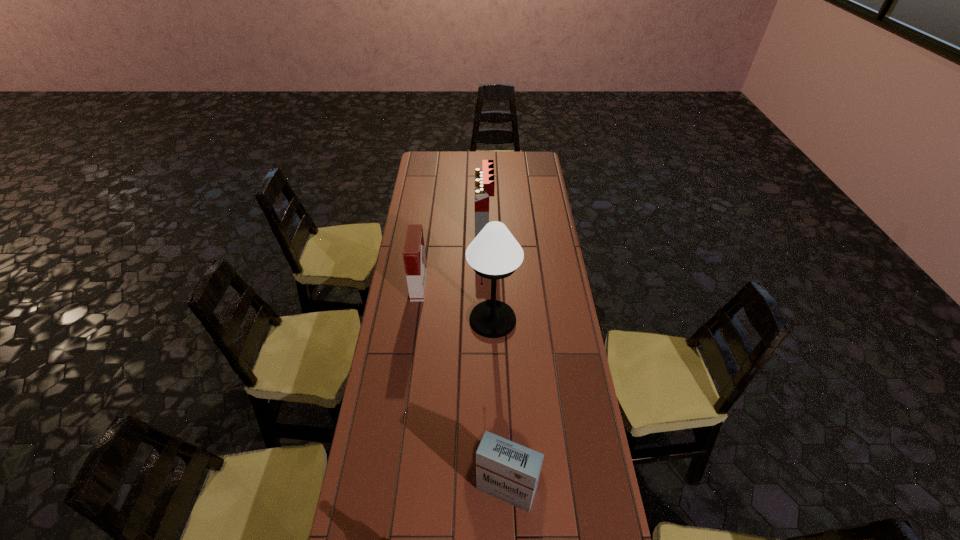
In order to click on vacant area located on the back of the fourth farthest object in this screenshot , I will do `click(501, 370)`.

The height and width of the screenshot is (540, 960). Identify the location of object present at the left edge. (414, 257).

Where is `vacant space at the far edge of the desktop`? vacant space at the far edge of the desktop is located at coordinates (514, 156).

In the image, there is a desktop. Identify the location of vacant space at the left edge. (399, 269).

In the image, there is a desktop. Find the location of `vacant area at the right edge`. vacant area at the right edge is located at coordinates (535, 175).

Where is `vacant space at the far left corner of the desktop`? vacant space at the far left corner of the desktop is located at coordinates (426, 154).

Locate an element on the screen. The image size is (960, 540). blank space at the far right corner of the desktop is located at coordinates (518, 153).

Image resolution: width=960 pixels, height=540 pixels. What are the coordinates of `empty location between the leftmost cigarette case and the farthest cigarette case` in the screenshot? It's located at (451, 257).

Where is `free space between the second nearest object and the tallest cigarette case`? The image size is (960, 540). free space between the second nearest object and the tallest cigarette case is located at coordinates (495, 359).

The height and width of the screenshot is (540, 960). Identify the location of vacant region between the second nearest object and the leftmost cigarette case. (463, 388).